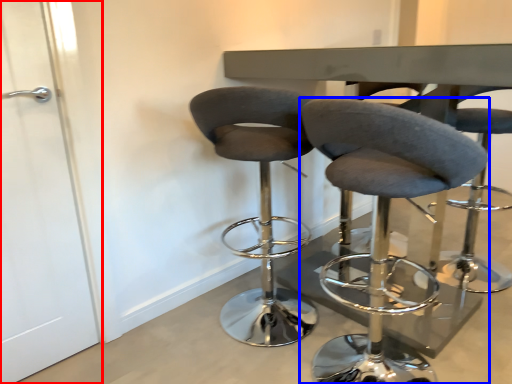
Question: Which object is closer to the camera taking this photo, screen door (highlighted by a red box) or chair (highlighted by a blue box)?

Choices:
 (A) screen door
 (B) chair

Answer: (B)